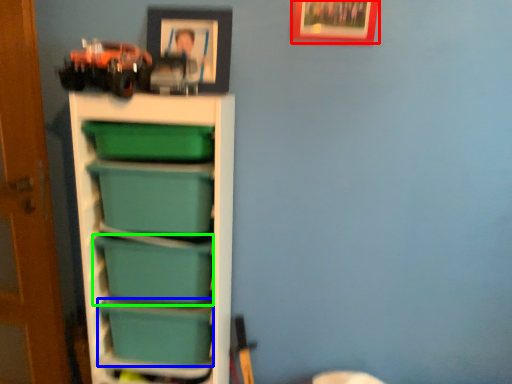
Question: Considering the real-world distances, which object is closest to picture frame (highlighted by a red box)? box (highlighted by a blue box) or box (highlighted by a green box).

Choices:
 (A) box
 (B) box

Answer: (B)